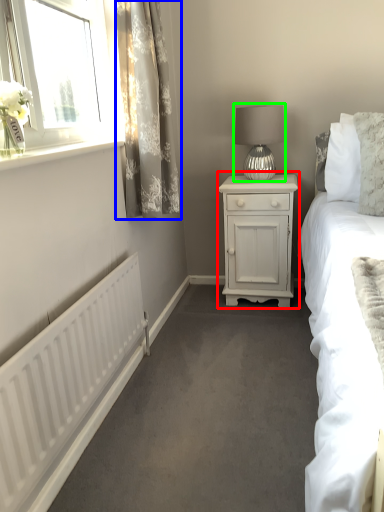
Question: Considering the real-world distances, which object is farthest from nightstand (highlighted by a red box)? curtain (highlighted by a blue box) or table lamp (highlighted by a green box)?

Choices:
 (A) curtain
 (B) table lamp

Answer: (A)